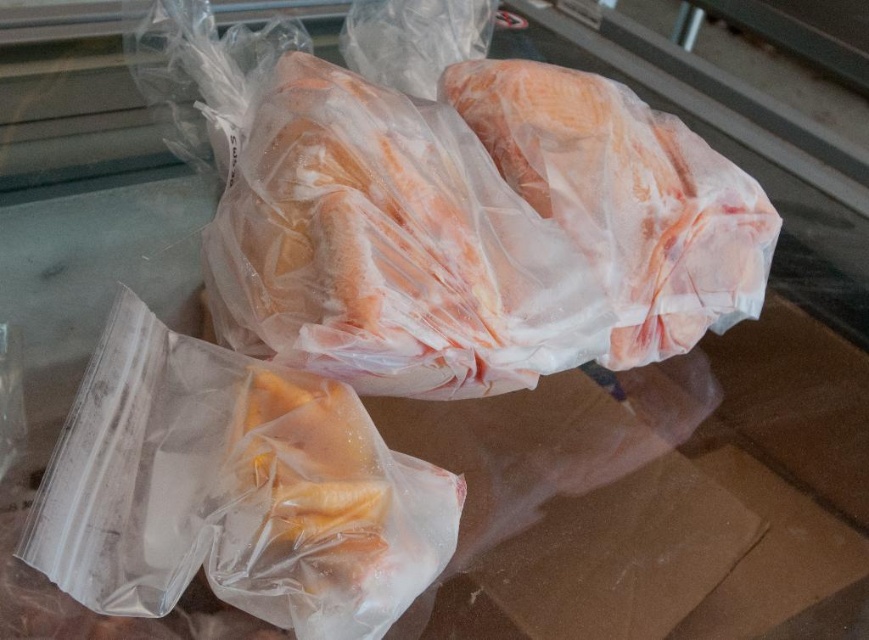
Which is above, translucent plastic bag at lower left or translucent plastic chicken at center?

Positioned higher is translucent plastic chicken at center.

Does translucent plastic bag at lower left have a smaller size compared to translucent plastic chicken at center?

No.

The width and height of the screenshot is (869, 640). Describe the element at coordinates (233, 490) in the screenshot. I see `translucent plastic bag at lower left` at that location.

This screenshot has width=869, height=640. What are the coordinates of `translucent plastic bag at lower left` in the screenshot? It's located at (233, 490).